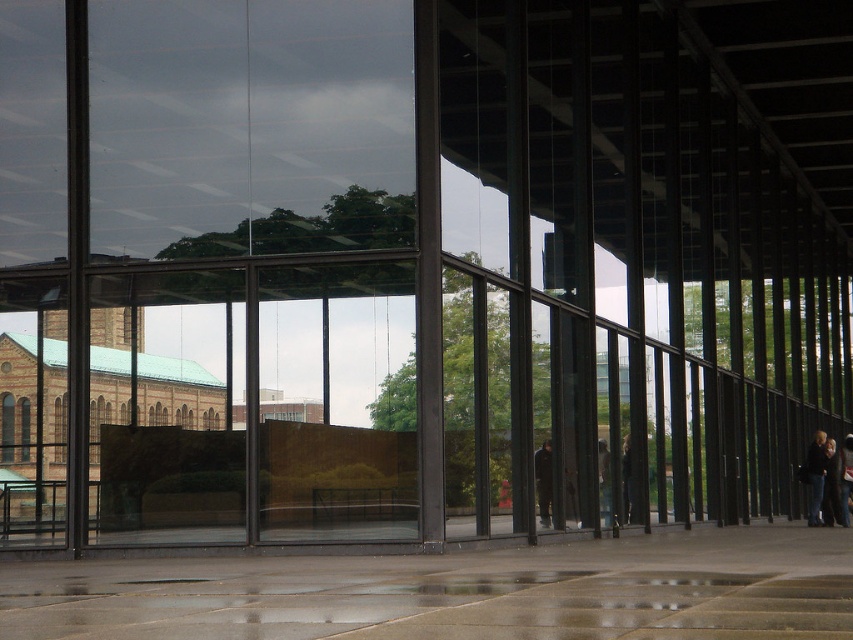
You are a fashion designer observing the modern architectural structure and notice two jackets displayed on mannequins. The dark blue jacket at lower right and the dark gray fabric jacket at center. Which jacket is wider?

The dark blue jacket at lower right is wider than the dark gray fabric jacket at center.